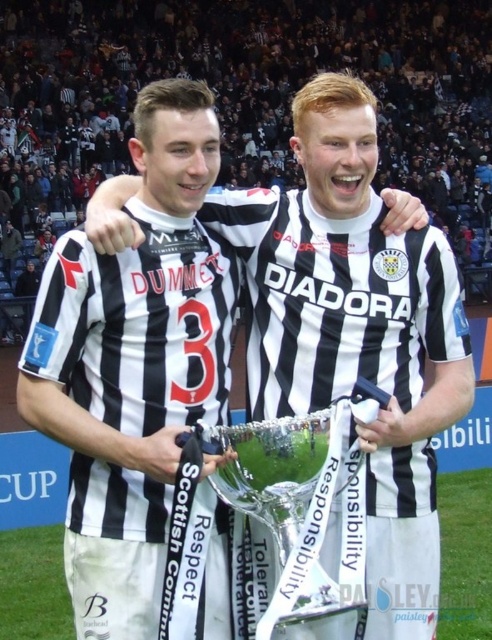
Where is `black and white jersey at center`? black and white jersey at center is located at coordinates (133, 364).

Is black and white jersey at center thinner than silver metallic trophy at center?

Indeed, black and white jersey at center has a lesser width compared to silver metallic trophy at center.

Locate an element on the screen. black and white jersey at center is located at coordinates (133, 364).

The height and width of the screenshot is (640, 492). What do you see at coordinates (133, 364) in the screenshot? I see `black and white jersey at center` at bounding box center [133, 364].

In order to click on black and white jersey at center in this screenshot , I will do `click(133, 364)`.

Which of these two, silver metallic trophy at center or green grass at center, stands taller?

Standing taller between the two is silver metallic trophy at center.

Can you confirm if silver metallic trophy at center is shorter than green grass at center?

No.

Is point (177, 612) farther from viewer compared to point (481, 502)?

No, (177, 612) is in front of (481, 502).

Find the location of a particular element. This screenshot has width=492, height=640. silver metallic trophy at center is located at coordinates (283, 516).